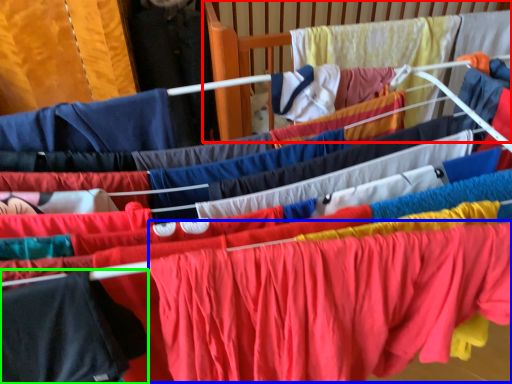
Question: Based on their relative distances, which object is farther from infant bed (highlighted by a red box)? Choose from clothing (highlighted by a blue box) and clothing (highlighted by a green box).

Choices:
 (A) clothing
 (B) clothing

Answer: (B)